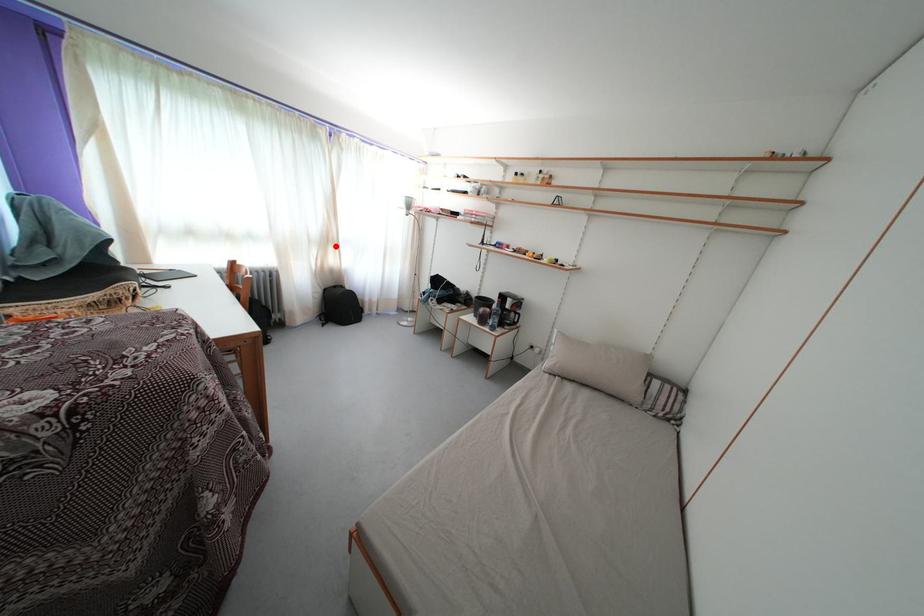
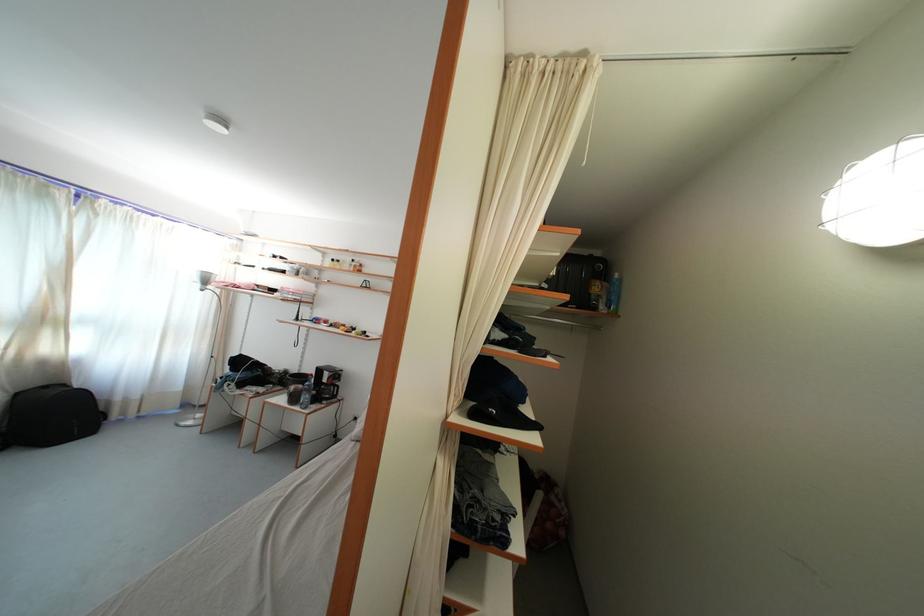
Question: I am providing you with two images of the same scene from different viewpoints. In image1, a red point is highlighted. Considering the same 3D point in image2, which of the following is correct?

Choices:
 (A) It is closer
 (B) It is farther

Answer: (B)